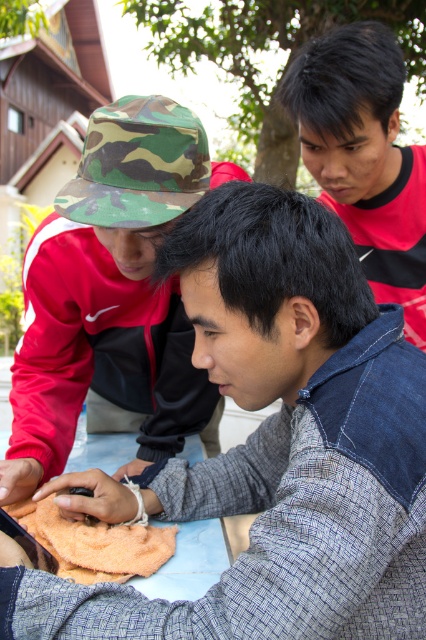
Which is behind, point (356, 401) or point (86, 552)?

The point (86, 552) is more distant.

Find the location of `camouflage fabric hat at upper left`. camouflage fabric hat at upper left is located at coordinates (279, 444).

This screenshot has width=426, height=640. What do you see at coordinates (279, 444) in the screenshot?
I see `camouflage fabric hat at upper left` at bounding box center [279, 444].

Looking at this image, is camouflage fabric hat at upper left taller than red shirt at upper right?

Incorrect, camouflage fabric hat at upper left's height is not larger of red shirt at upper right's.

Between point (316, 228) and point (396, 214), which one is positioned in front?

Positioned in front is point (316, 228).

You are a GUI agent. You are given a task and a screenshot of the screen. Output one action in this format:
    pyautogui.click(x=<x>, y=<y>)
    Task: Click on the camouflage fabric hat at upper left
    
    Given the screenshot: What is the action you would take?
    pyautogui.click(x=279, y=444)

Is point (199, 396) positioned before point (370, 218)?

Yes, point (199, 396) is closer to viewer.

Who is shorter, camo hat at upper left or red shirt at upper right?

Standing shorter between the two is red shirt at upper right.

The height and width of the screenshot is (640, 426). I want to click on camo hat at upper left, so click(112, 296).